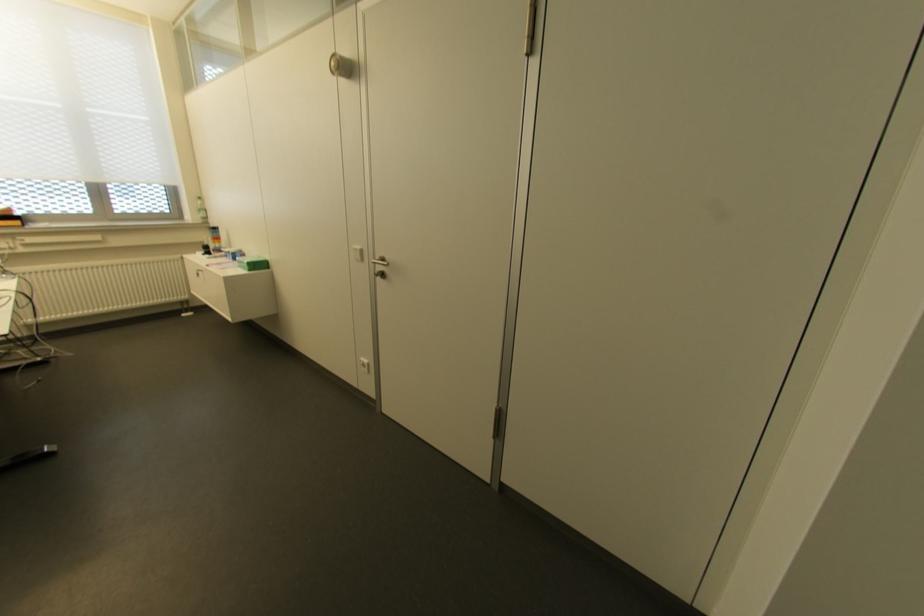
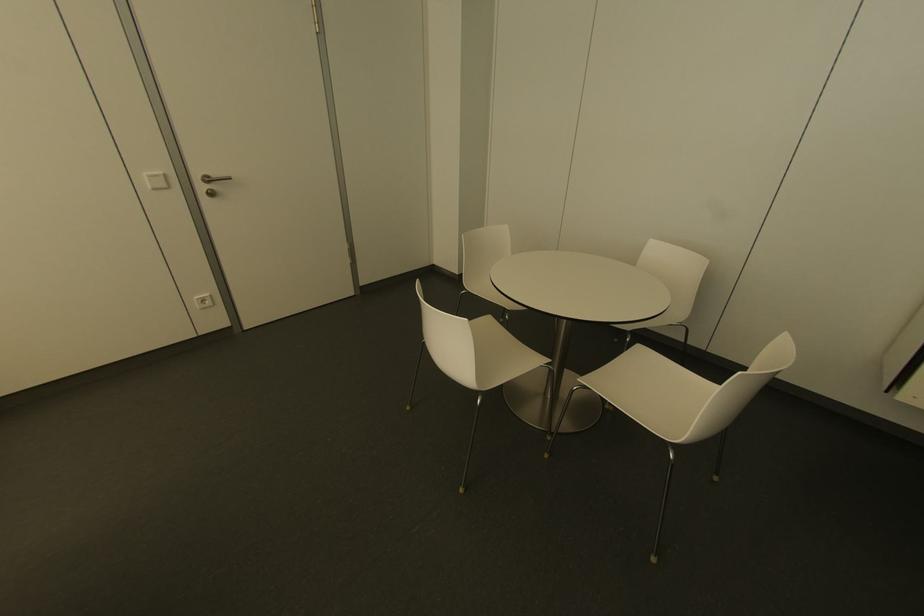
Locate, in the second image, the point that corresponds to pixel 358 246 in the first image.

(159, 172)